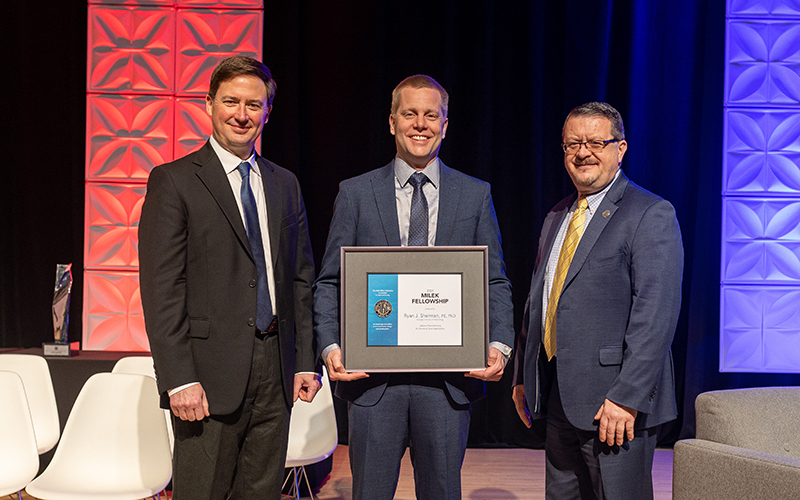
The image size is (800, 500). Identify the location of wood table. (70, 366).